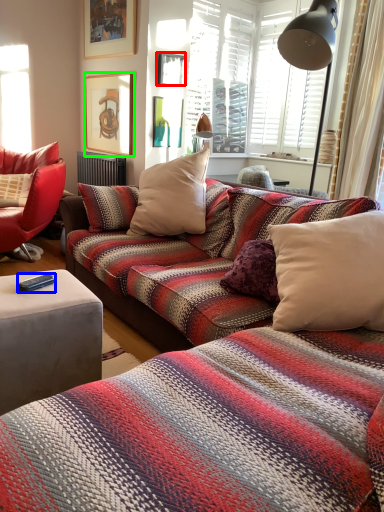
Question: Based on their relative distances, which object is nearer to picture frame (highlighted by a red box)? Choose from remote control (highlighted by a blue box) and picture frame (highlighted by a green box).

Choices:
 (A) remote control
 (B) picture frame

Answer: (B)